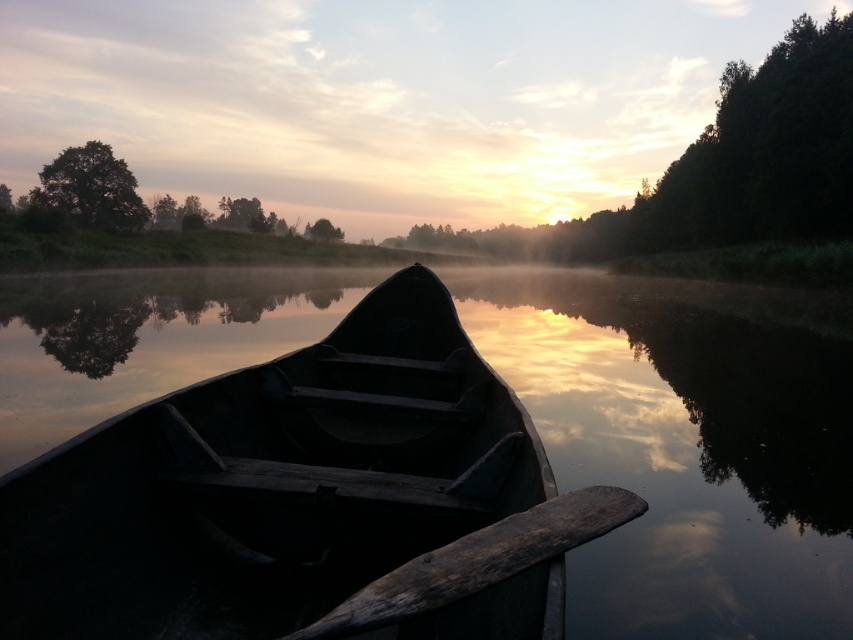
Can you confirm if green leafy tree at upper left is bigger than green matte tree at upper center?

Indeed, green leafy tree at upper left has a larger size compared to green matte tree at upper center.

Does point (51, 170) lie in front of point (311, 232)?

Yes, point (51, 170) is closer to viewer.

Image resolution: width=853 pixels, height=640 pixels. Find the location of `green leafy tree at upper left`. green leafy tree at upper left is located at coordinates (91, 189).

Between dark wood boat at center and green leafy tree at upper left, which one appears on the right side from the viewer's perspective?

Positioned to the right is dark wood boat at center.

Find the location of a particular element. The height and width of the screenshot is (640, 853). dark wood boat at center is located at coordinates (270, 483).

Between dark wood boat at center and dark brown wooden paddle at center, which one has less height?

With less height is dark brown wooden paddle at center.

The width and height of the screenshot is (853, 640). What are the coordinates of `dark wood boat at center` in the screenshot? It's located at (270, 483).